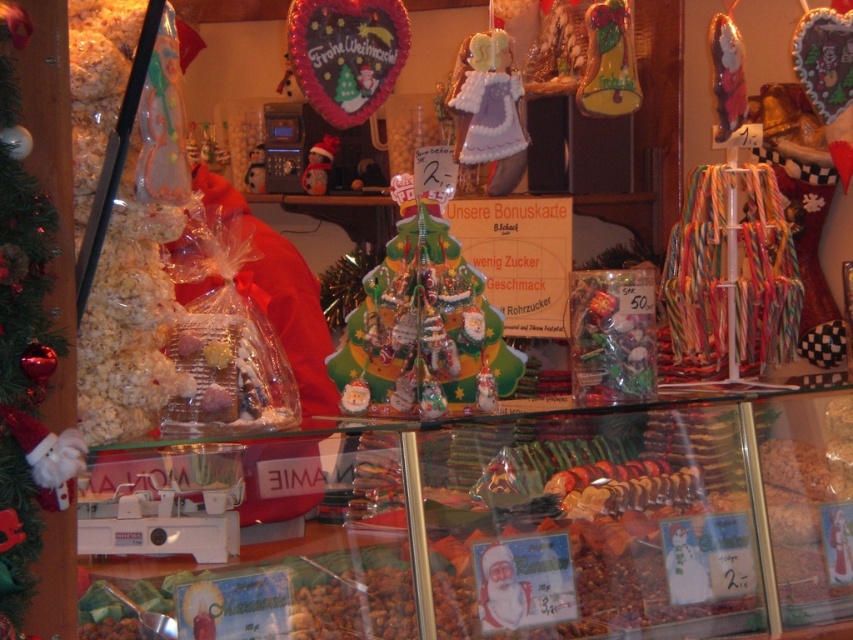
Question: Is shiny red bauble at left wider than shiny green candy at center?

Choices:
 (A) no
 (B) yes

Answer: (A)

Question: Can you confirm if shiny red bauble at left is positioned to the left of shiny green candy at center?

Choices:
 (A) no
 (B) yes

Answer: (B)

Question: Among these points, which one is nearest to the camera?

Choices:
 (A) (28, 378)
 (B) (485, 316)

Answer: (A)

Question: Is shiny red bauble at left bigger than shiny green candy at center?

Choices:
 (A) yes
 (B) no

Answer: (B)